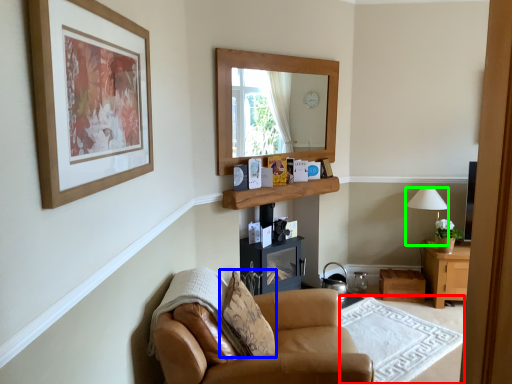
Question: Based on their relative distances, which object is farther from plain (highlighted by a red box)? Choose from pillow (highlighted by a blue box) and lamp (highlighted by a green box).

Choices:
 (A) pillow
 (B) lamp

Answer: (B)